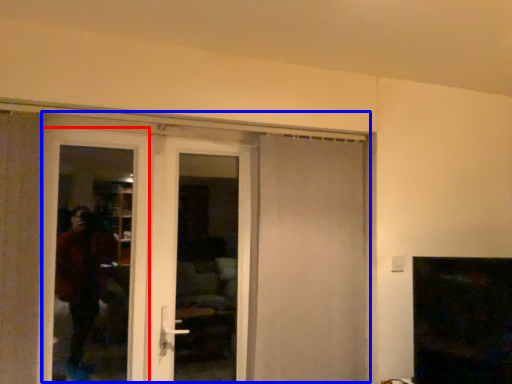
Question: Which object is further to the camera taking this photo, screen door (highlighted by a red box) or door (highlighted by a blue box)?

Choices:
 (A) screen door
 (B) door

Answer: (A)